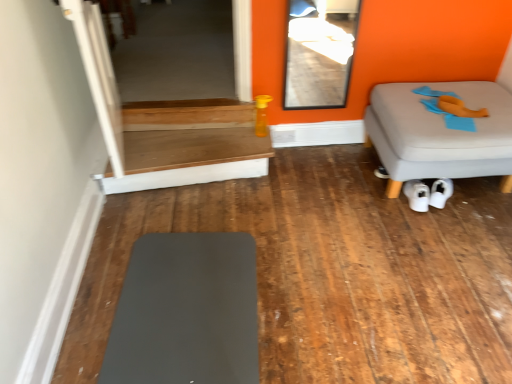
The height and width of the screenshot is (384, 512). I want to click on empty space that is in between white matte sneakers at lower center and wooden table at center, so click(311, 192).